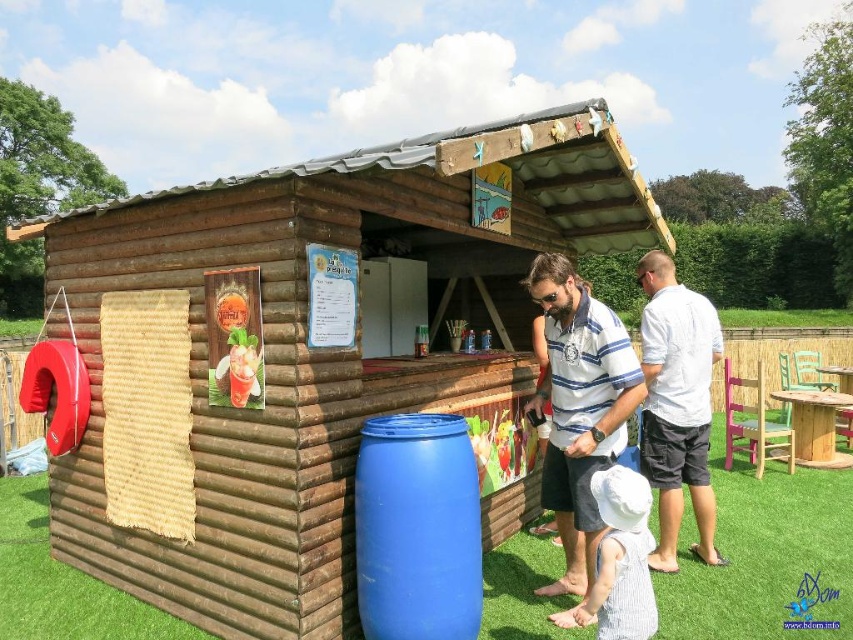
Is point (583, 545) in front of point (630, 620)?

No, it is not.

Image resolution: width=853 pixels, height=640 pixels. Identify the location of white striped polo shirt at center. (579, 408).

Is blue plastic barrel at center bigger than white cotton shirt at right?

No.

Who is more distant from viewer, (477, 557) or (712, 308)?

Positioned behind is point (712, 308).

In order to click on blue plastic barrel at center in this screenshot , I will do `click(416, 529)`.

Does brown wooden log cabin at center appear on the left side of white striped polo shirt at center?

Indeed, brown wooden log cabin at center is positioned on the left side of white striped polo shirt at center.

Can you confirm if brown wooden log cabin at center is positioned above white striped polo shirt at center?

Correct, brown wooden log cabin at center is located above white striped polo shirt at center.

The height and width of the screenshot is (640, 853). What do you see at coordinates (293, 349) in the screenshot?
I see `brown wooden log cabin at center` at bounding box center [293, 349].

Find the location of a particular element. brown wooden log cabin at center is located at coordinates (293, 349).